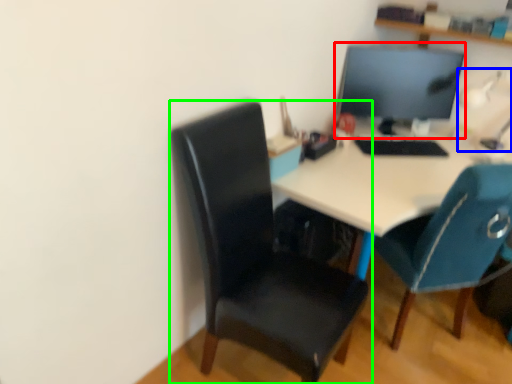
Question: Considering the real-world distances, which object is closest to computer monitor (highlighted by a red box)? table lamp (highlighted by a blue box) or chair (highlighted by a green box).

Choices:
 (A) table lamp
 (B) chair

Answer: (A)